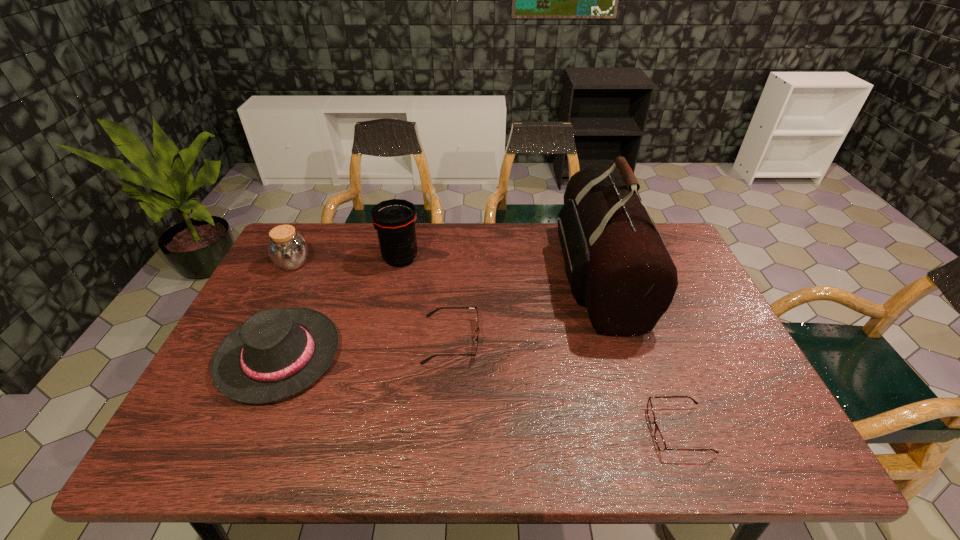
You are a GUI agent. You are given a task and a screenshot of the screen. Output one action in this format:
    pyautogui.click(x=<x>, y=<y>)
    Task: Click on the duffel bag
    The image size is (960, 540).
    Given the screenshot: What is the action you would take?
    pyautogui.click(x=616, y=263)

You are a GUI agent. You are given a task and a screenshot of the screen. Output one action in this format:
    pyautogui.click(x=<x>, y=<y>)
    Task: Click on the third object from left to right
    
    Given the screenshot: What is the action you would take?
    pyautogui.click(x=395, y=219)

Where is `the second tallest object`? This screenshot has height=540, width=960. the second tallest object is located at coordinates (395, 219).

Locate an element on the screen. jar is located at coordinates (288, 250).

Where is `dress hat`? The height and width of the screenshot is (540, 960). dress hat is located at coordinates (276, 353).

Find the location of a particular element. the farther spectacles is located at coordinates (429, 314).

Locate an element on the screen. The height and width of the screenshot is (540, 960). the taller spectacles is located at coordinates (429, 314).

Where is `the shorter spectacles`? The width and height of the screenshot is (960, 540). the shorter spectacles is located at coordinates (660, 442).

The image size is (960, 540). Identify the location of the right spectacles. (660, 442).

Locate an element on the screen. The width and height of the screenshot is (960, 540). free space located 0.130m on the front pocket of the duffel bag is located at coordinates (516, 276).